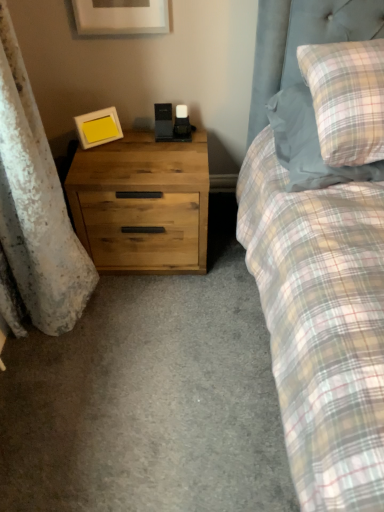
Question: Does matte yellow picture frame at left, which is the 1th picture frame in bottom-to-top order, have a greater height compared to plaid fabric pillow at upper right?

Choices:
 (A) no
 (B) yes

Answer: (A)

Question: Can you confirm if matte yellow picture frame at left, the second picture frame viewed from the top, is wider than plaid fabric pillow at upper right?

Choices:
 (A) no
 (B) yes

Answer: (A)

Question: Considering the relative sizes of matte yellow picture frame at left, which is the 1th picture frame in bottom-to-top order, and plaid fabric pillow at upper right in the image provided, is matte yellow picture frame at left, which is the 1th picture frame in bottom-to-top order, bigger than plaid fabric pillow at upper right?

Choices:
 (A) yes
 (B) no

Answer: (B)

Question: Can you confirm if matte yellow picture frame at left, acting as the 2th picture frame starting from the front, is smaller than plaid fabric pillow at upper right?

Choices:
 (A) yes
 (B) no

Answer: (A)

Question: Are matte yellow picture frame at left, which appears as the 1th picture frame when viewed from the back, and plaid fabric pillow at upper right located far from each other?

Choices:
 (A) yes
 (B) no

Answer: (B)

Question: Is matte yellow picture frame at left, acting as the 2th picture frame starting from the front, behind plaid fabric pillow at upper right?

Choices:
 (A) yes
 (B) no

Answer: (A)

Question: Considering the relative sizes of plaid fabric pillow at upper right and matte yellow picture frame at left, which appears as the 1th picture frame when viewed from the back, in the image provided, is plaid fabric pillow at upper right thinner than matte yellow picture frame at left, which appears as the 1th picture frame when viewed from the back,?

Choices:
 (A) yes
 (B) no

Answer: (B)

Question: From the image's perspective, does plaid fabric pillow at upper right appear lower than matte yellow picture frame at left, the second picture frame viewed from the top?

Choices:
 (A) yes
 (B) no

Answer: (A)

Question: Is plaid fabric pillow at upper right further to camera compared to matte yellow picture frame at left, the second picture frame viewed from the top?

Choices:
 (A) no
 (B) yes

Answer: (A)

Question: Is the depth of plaid fabric pillow at upper right less than that of matte yellow picture frame at left, the second picture frame viewed from the top?

Choices:
 (A) no
 (B) yes

Answer: (B)

Question: Is plaid fabric pillow at upper right oriented away from matte yellow picture frame at left, the second picture frame viewed from the top?

Choices:
 (A) yes
 (B) no

Answer: (B)

Question: Could matte yellow picture frame at left, which is the 1th picture frame in bottom-to-top order, be considered to be inside plaid fabric pillow at upper right?

Choices:
 (A) yes
 (B) no

Answer: (B)

Question: Is matte white picture frame at upper center, the first picture frame positioned from the front, a part of matte yellow picture frame at left, which appears as the 1th picture frame when viewed from the back?

Choices:
 (A) no
 (B) yes

Answer: (A)